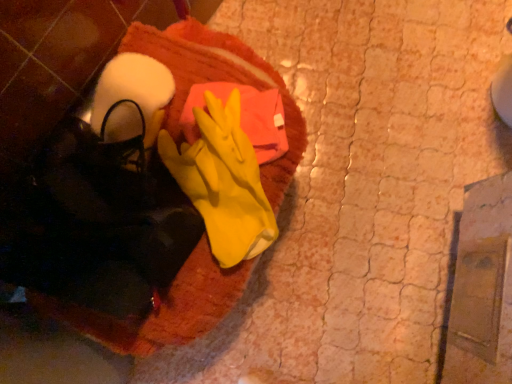
I want to click on free spot above orange towel at center (from a real-world perspective), so click(174, 153).